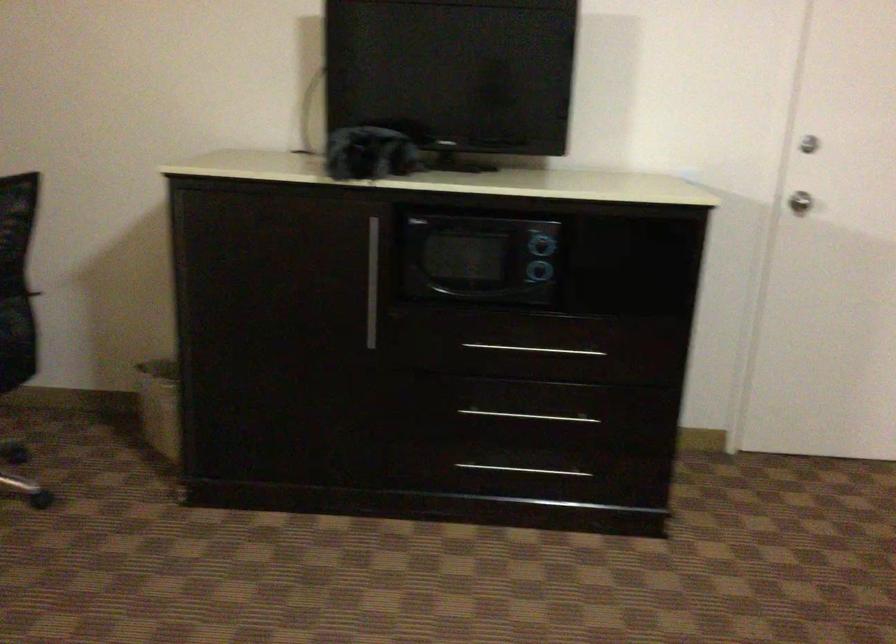
Identify the location of door lock. (799, 202).